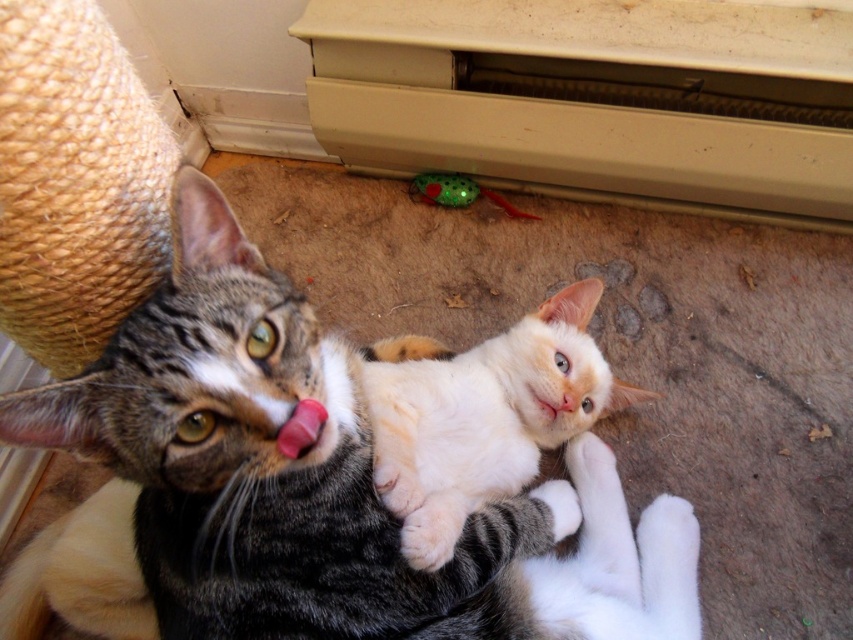
Is tabby fur cat at center thinner than white matte mouth at center?

No.

Does tabby fur cat at center have a lesser height compared to white matte mouth at center?

Incorrect, tabby fur cat at center's height does not fall short of white matte mouth at center's.

Who is more distant from viewer, (320, 531) or (538, 404)?

The point (538, 404) is more distant.

Where is `tabby fur cat at center`? tabby fur cat at center is located at coordinates (300, 490).

Is white fur at lower center shorter than green glossy toy mouse at center?

Yes.

Who is lower down, white fur at lower center or green glossy toy mouse at center?

white fur at lower center is below.

Which is in front, point (440, 509) or point (436, 188)?

Point (440, 509) is in front.

The height and width of the screenshot is (640, 853). Identify the location of white fur at lower center. (433, 529).

From the picture: Who is lower down, green glossy toy mouse at center or white matte mouth at center?

white matte mouth at center

Can you confirm if green glossy toy mouse at center is smaller than white matte mouth at center?

No, green glossy toy mouse at center is not smaller than white matte mouth at center.

You are a GUI agent. You are given a task and a screenshot of the screen. Output one action in this format:
    pyautogui.click(x=<x>, y=<y>)
    Task: Click on the green glossy toy mouse at center
    The width and height of the screenshot is (853, 640).
    Given the screenshot: What is the action you would take?
    pyautogui.click(x=459, y=193)

Where is `green glossy toy mouse at center`? green glossy toy mouse at center is located at coordinates (459, 193).